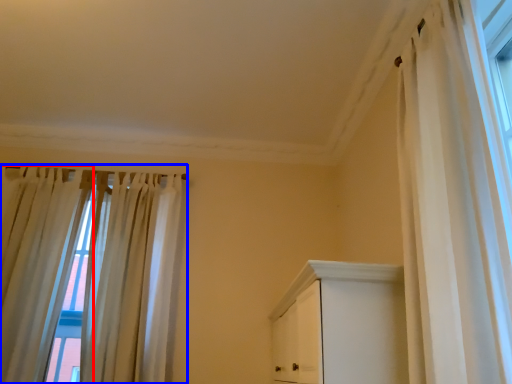
Question: Which point is closer to the camera, curtain (highlighted by a red box) or curtain (highlighted by a blue box)?

Choices:
 (A) curtain
 (B) curtain

Answer: (A)